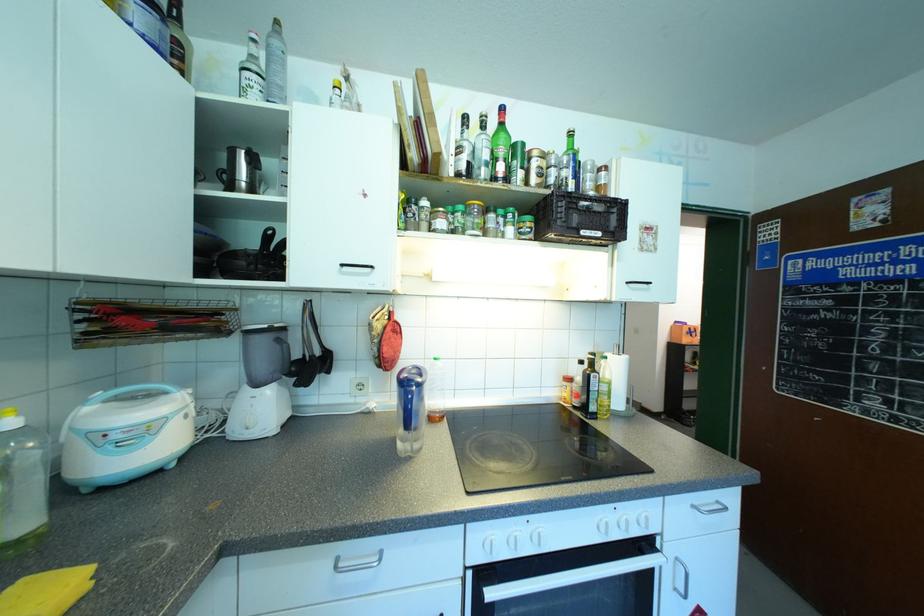
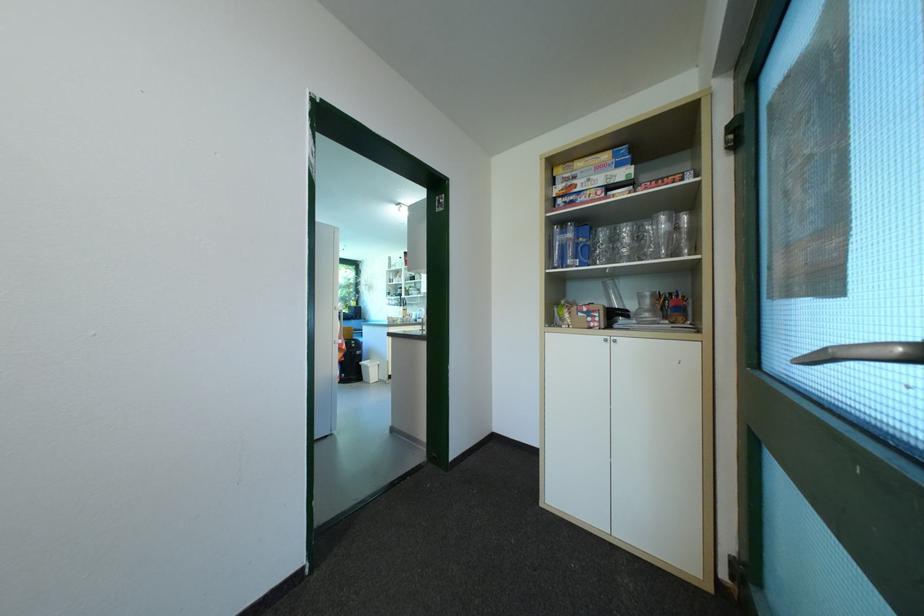
Question: I am providing you with two images of the same scene from different viewpoints. Which of the following objects are not visible in image2?

Choices:
 (A) silver device buttons
 (B) white oven knob
 (C) blue cardboard box
 (D) glass carafe

Answer: (B)